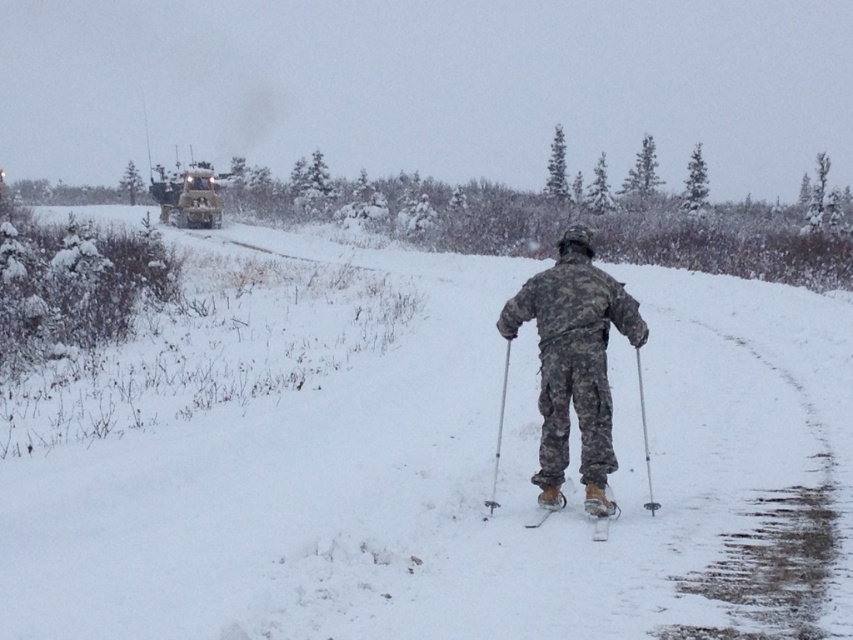
Question: Does white matte snow at center have a larger size compared to metallic silver ski pole at center?

Choices:
 (A) yes
 (B) no

Answer: (A)

Question: Is white matte snow at center to the left of camouflage fabric skier at center from the viewer's perspective?

Choices:
 (A) yes
 (B) no

Answer: (A)

Question: Is white matte snow at center wider than camouflage fabric skier at center?

Choices:
 (A) yes
 (B) no

Answer: (A)

Question: Estimate the real-world distances between objects in this image. Which object is farther from the white matte snow at center?

Choices:
 (A) silver metallic ski pole at center
 (B) metallic silver ski pole at center

Answer: (A)

Question: Which of the following is the farthest from the observer?

Choices:
 (A) (830, 436)
 (B) (496, 451)
 (C) (593, 516)
 (D) (624, 301)

Answer: (A)

Question: Estimate the real-world distances between objects in this image. Which object is farther from the white matte snow at center?

Choices:
 (A) metallic silver ski pole at center
 (B) camouflage fabric skier at center
 (C) camouflage-patterned ski at center
 (D) silver metallic ski pole at center

Answer: (C)